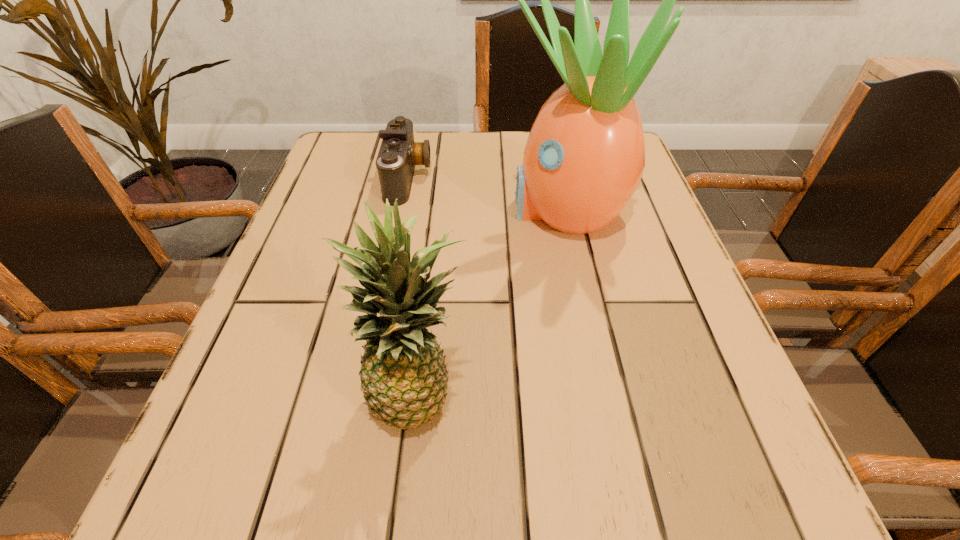
Find the location of a particular element. This screenshot has height=540, width=960. vacant space at the near right corner of the desktop is located at coordinates (749, 487).

Find the location of a particular element. This screenshot has height=540, width=960. free space between the taller pineapple and the left pineapple is located at coordinates (493, 301).

Where is `vacant point located between the farther pineapple and the nearer pineapple`? This screenshot has width=960, height=540. vacant point located between the farther pineapple and the nearer pineapple is located at coordinates (493, 301).

Locate an element on the screen. free spot between the left pineapple and the tallest object is located at coordinates click(x=493, y=301).

This screenshot has height=540, width=960. What are the coordinates of `free space between the left pineapple and the farther pineapple` in the screenshot? It's located at pos(493,301).

This screenshot has width=960, height=540. Identify the location of object that is the second closest to the taller pineapple. (403, 374).

Locate which object is the closest to the shortest object. Please provide its 2D coordinates. Your answer should be formatted as a tuple, i.e. [(x, y)], where the tuple contains the x and y coordinates of a point satisfying the conditions above.

[(584, 158)]

Locate an element on the screen. This screenshot has height=540, width=960. vacant region that satisfies the following two spatial constraints: 1. on the lens of the second shortest object; 2. on the right side of the camera is located at coordinates (364, 394).

You are a GUI agent. You are given a task and a screenshot of the screen. Output one action in this format:
    pyautogui.click(x=<x>, y=<y>)
    Task: Click on the vacant space that satisfies the following two spatial constraints: 1. at the entrance of the taller pineapple; 2. on the front side of the nearest object
    
    Given the screenshot: What is the action you would take?
    pyautogui.click(x=606, y=394)

This screenshot has width=960, height=540. I want to click on vacant region that satisfies the following two spatial constraints: 1. on the lens of the nearer pineapple; 2. on the left side of the camera, so click(x=364, y=394).